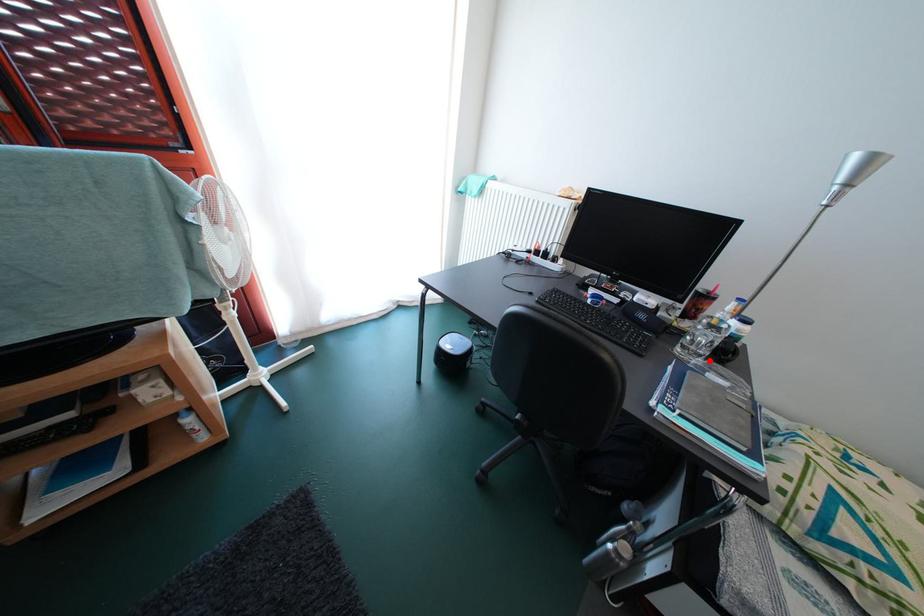
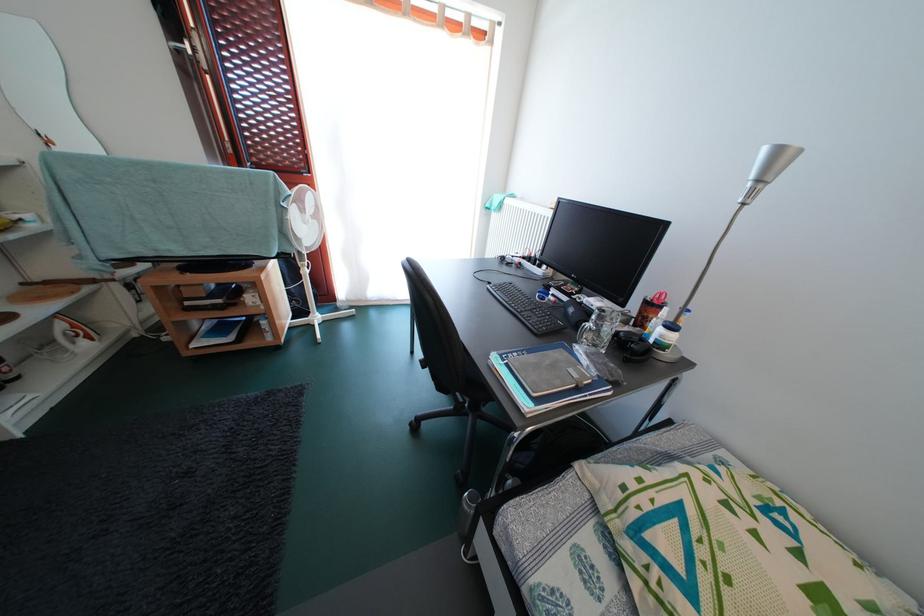
Locate, in the second image, the point that corresponds to the highlighted location in the first image.

(602, 351)